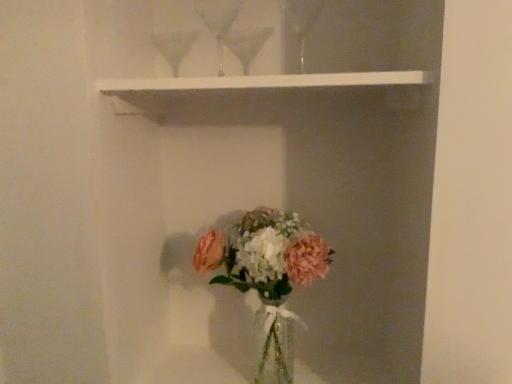
Question: Considering the positions of translucent glass vase at lower center and white matte shelf at upper center in the image, is translucent glass vase at lower center taller or shorter than white matte shelf at upper center?

Choices:
 (A) short
 (B) tall

Answer: (B)

Question: Based on their positions, is translucent glass vase at lower center located to the left or right of white matte shelf at upper center?

Choices:
 (A) right
 (B) left

Answer: (A)

Question: From the image's perspective, relative to white matte shelf at upper center, is translucent glass vase at lower center above or below?

Choices:
 (A) above
 (B) below

Answer: (B)

Question: From a real-world perspective, relative to translucent glass vase at lower center, is white matte shelf at upper center vertically above or below?

Choices:
 (A) above
 (B) below

Answer: (A)

Question: In terms of width, does white matte shelf at upper center look wider or thinner when compared to translucent glass vase at lower center?

Choices:
 (A) thin
 (B) wide

Answer: (B)

Question: Which is correct: white matte shelf at upper center is inside translucent glass vase at lower center, or outside of it?

Choices:
 (A) inside
 (B) outside

Answer: (B)

Question: Does point (294, 86) appear closer or farther from the camera than point (265, 375)?

Choices:
 (A) closer
 (B) farther

Answer: (A)